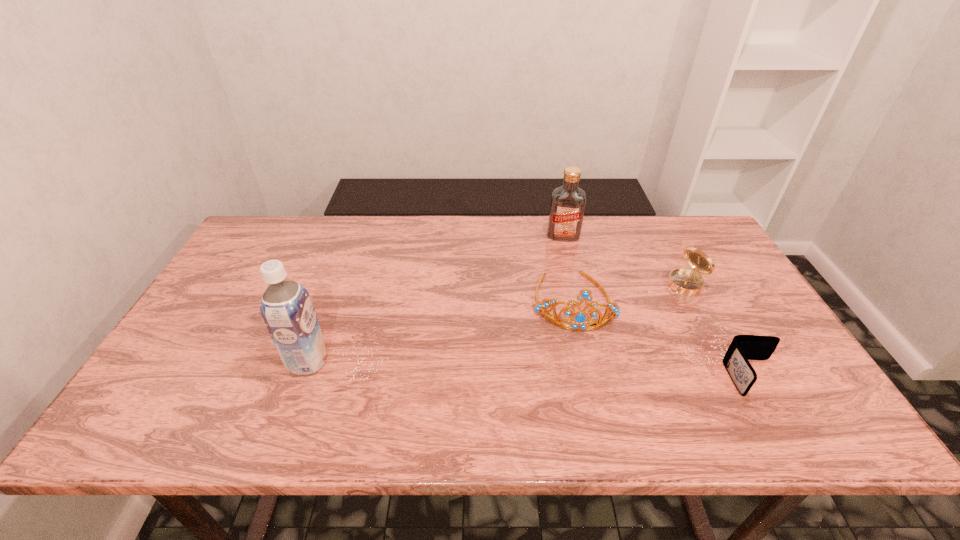
Where is `vacant space located on the front-facing side of the fourth shortest object`? vacant space located on the front-facing side of the fourth shortest object is located at coordinates (562, 302).

Where is `vacant space located 0.210m on the front-facing side of the fourth shortest object`? Image resolution: width=960 pixels, height=540 pixels. vacant space located 0.210m on the front-facing side of the fourth shortest object is located at coordinates (562, 286).

Locate an element on the screen. The image size is (960, 540). free location located on the front-facing side of the fourth shortest object is located at coordinates (562, 310).

You are a GUI agent. You are given a task and a screenshot of the screen. Output one action in this format:
    pyautogui.click(x=<x>, y=<y>)
    Task: Click on the free spot located on the front-facing side of the tiara
    This screenshot has width=960, height=540.
    Given the screenshot: What is the action you would take?
    pyautogui.click(x=583, y=385)

Identify the location of vacant position located on the front-facing side of the tiara. The height and width of the screenshot is (540, 960). coord(583,385).

Find the location of a particular element. This screenshot has height=540, width=960. vacant space located on the front-facing side of the tiara is located at coordinates (579, 351).

At what (x,y) coordinates should I click in order to perform the action: click on vacant area situated 0.330m with the dial facing the compass. Please return your answer as a coordinate pair (x, y). This screenshot has width=960, height=540. Looking at the image, I should click on (591, 343).

Find the location of a particular element. This screenshot has width=960, height=540. vacant area situated with the dial facing the compass is located at coordinates (575, 355).

You are a GUI agent. You are given a task and a screenshot of the screen. Output one action in this format:
    pyautogui.click(x=<x>, y=<y>)
    Task: Click on the free point located with the dial facing the compass
    This screenshot has width=960, height=540.
    Given the screenshot: What is the action you would take?
    pyautogui.click(x=613, y=329)

This screenshot has height=540, width=960. I want to click on object positioned at the far edge, so click(567, 207).